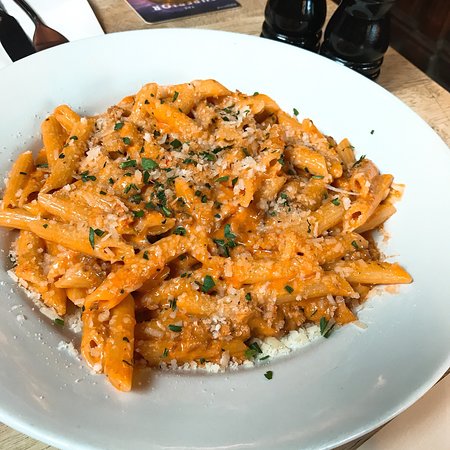
Identify the location of silverware. The width and height of the screenshot is (450, 450). (50, 33), (18, 36).